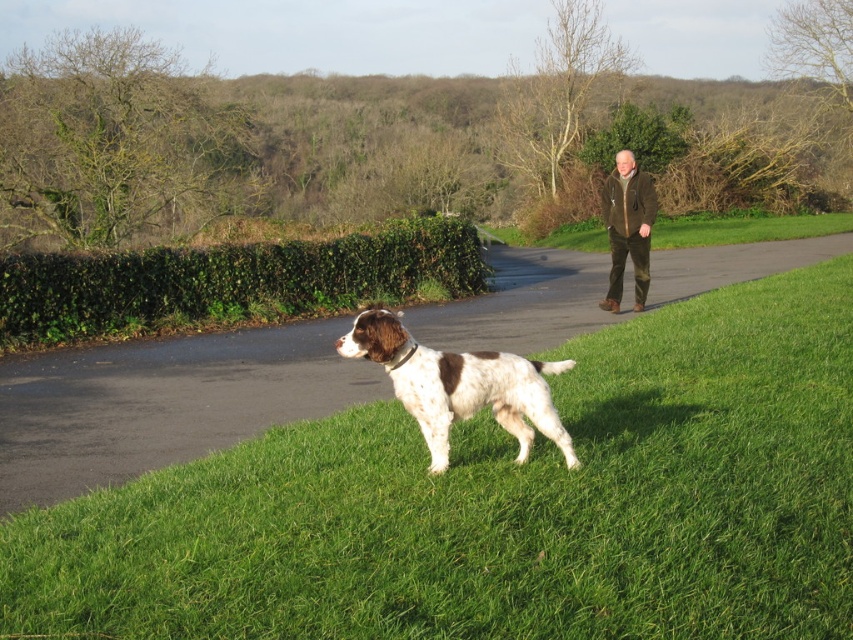
You are standing at point (641,212) and want to walk to the dog. Which direction should you go relative to point (509,387)?

Point (509,387) is in front of point (641,212), so you should walk towards the direction of point (509,387) to reach the dog.

You are standing at the starting point of your walk and see the green asphalt path at center. If you want to follow the path, which direction should you walk relative to the dog?

The green asphalt path at center is located at point (161, 403), so you should walk towards the center of the image where the path is located to follow it.

You are standing at a point equidistant between point (190, 250) and point (621, 230). If you want to move closer to the dog, which point should you walk towards?

You should walk towards point (190, 250) because it is closer to the dog than point (621, 230).